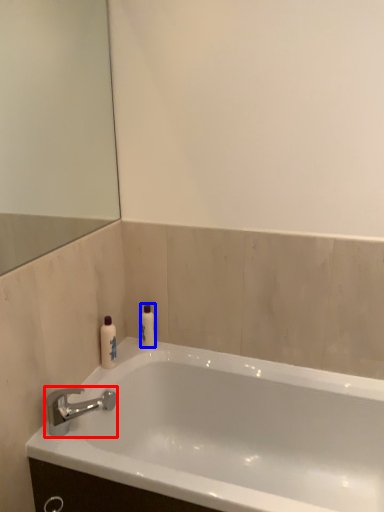
Question: Which object appears farthest to the camera in this image, tap (highlighted by a red box) or toiletry (highlighted by a blue box)?

Choices:
 (A) tap
 (B) toiletry

Answer: (B)